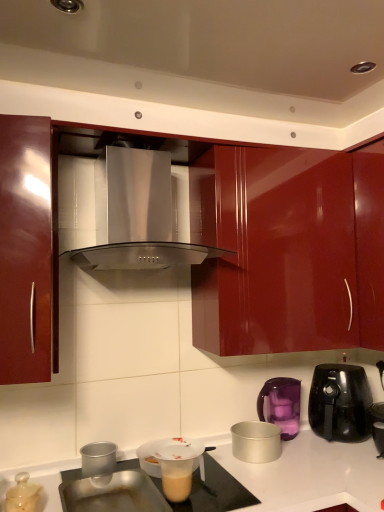
How much space does silver metallic pot at lower center, positioned as the 3th kitchen appliance in left-to-right order, occupy horizontally?

8.74 inches.

Find the location of `black glossy air fryer at right, acting as the 1th kitchen appliance starting from the right`. black glossy air fryer at right, acting as the 1th kitchen appliance starting from the right is located at coordinates (340, 403).

Find the location of a particular element. purple plastic kettle at right, which is the fourth kitchen appliance from left to right is located at coordinates [x=281, y=405].

Find the location of a particular element. The width and height of the screenshot is (384, 512). translucent plastic cup at lower center is located at coordinates (174, 464).

Which is correct: silver metallic pot at lower center, positioned as the 3th kitchen appliance in left-to-right order, is inside translucent plastic lid at lower left, marked as the 5th kitchen appliance in a right-to-left arrangement, or outside of it?

silver metallic pot at lower center, positioned as the 3th kitchen appliance in left-to-right order, is outside translucent plastic lid at lower left, marked as the 5th kitchen appliance in a right-to-left arrangement.

From the image's perspective, is silver metallic pot at lower center, positioned as the 3th kitchen appliance in left-to-right order, beneath translucent plastic lid at lower left, marked as the 1th kitchen appliance in a left-to-right arrangement?

Indeed, from the image's perspective, silver metallic pot at lower center, positioned as the 3th kitchen appliance in left-to-right order, is shown beneath translucent plastic lid at lower left, marked as the 1th kitchen appliance in a left-to-right arrangement.

How much distance is there between silver metallic pot at lower center, positioned as the 3th kitchen appliance in left-to-right order, and translucent plastic lid at lower left, marked as the 1th kitchen appliance in a left-to-right arrangement?

32.76 inches.

Can we say silver metallic pot at lower center, the 3th kitchen appliance from the right, lies outside black glossy air fryer at right, acting as the 1th kitchen appliance starting from the right?

Yes, silver metallic pot at lower center, the 3th kitchen appliance from the right, is located beyond the bounds of black glossy air fryer at right, acting as the 1th kitchen appliance starting from the right.

Locate an element on the screen. the 2nd kitchen appliance to the left of the black glossy air fryer at right, the 5th kitchen appliance positioned from the left, counting from the anchor's position is located at coordinates (256, 441).

Can you confirm if silver metallic pot at lower center, positioned as the 3th kitchen appliance in left-to-right order, is positioned to the right of black glossy air fryer at right, acting as the 1th kitchen appliance starting from the right?

No, silver metallic pot at lower center, positioned as the 3th kitchen appliance in left-to-right order, is not to the right of black glossy air fryer at right, acting as the 1th kitchen appliance starting from the right.

Between silver metallic pot at lower center, the 3th kitchen appliance from the right, and black glossy air fryer at right, the 5th kitchen appliance positioned from the left, which one has more height?

black glossy air fryer at right, the 5th kitchen appliance positioned from the left.

Consider the image. Considering the positions of objects stainless steel range hood at center and purple plastic kettle at right, positioned as the second kitchen appliance in right-to-left order, in the image provided, who is behind, stainless steel range hood at center or purple plastic kettle at right, positioned as the second kitchen appliance in right-to-left order,?

purple plastic kettle at right, positioned as the second kitchen appliance in right-to-left order, is more distant.

Is point (188, 197) closer or farther from the camera than point (258, 408)?

Point (188, 197) appears to be closer to the viewer than point (258, 408).

Would you say purple plastic kettle at right, positioned as the second kitchen appliance in right-to-left order, is part of stainless steel range hood at center's contents?

No, purple plastic kettle at right, positioned as the second kitchen appliance in right-to-left order, is located outside of stainless steel range hood at center.

From a real-world perspective, is stainless steel range hood at center above or below purple plastic kettle at right, which is the fourth kitchen appliance from left to right?

From a real-world perspective, stainless steel range hood at center is physically above purple plastic kettle at right, which is the fourth kitchen appliance from left to right.

Which of these two, glossy red cabinet at left or translucent plastic lid at lower left, marked as the 5th kitchen appliance in a right-to-left arrangement, is wider?

Wider between the two is glossy red cabinet at left.

Considering the relative sizes of glossy red cabinet at left and translucent plastic lid at lower left, marked as the 1th kitchen appliance in a left-to-right arrangement, in the image provided, is glossy red cabinet at left taller than translucent plastic lid at lower left, marked as the 1th kitchen appliance in a left-to-right arrangement,?

Indeed, glossy red cabinet at left has a greater height compared to translucent plastic lid at lower left, marked as the 1th kitchen appliance in a left-to-right arrangement.

From the image's perspective, would you say glossy red cabinet at left is positioned over translucent plastic lid at lower left, marked as the 5th kitchen appliance in a right-to-left arrangement?

Correct, glossy red cabinet at left appears higher than translucent plastic lid at lower left, marked as the 5th kitchen appliance in a right-to-left arrangement, in the image.

Is stainless steel range hood at center oriented away from translucent plastic cup at lower center?

No, stainless steel range hood at center is not facing away from translucent plastic cup at lower center.

From the image's perspective, which is above, stainless steel range hood at center or translucent plastic cup at lower center?

stainless steel range hood at center appears higher in the image.

I want to click on appliance on the right of stainless steel range hood at center, so click(x=174, y=464).

Is stainless steel range hood at center wider or thinner than translucent plastic cup at lower center?

stainless steel range hood at center is wider than translucent plastic cup at lower center.

Considering the relative sizes of glossy red cabinet at left and purple plastic kettle at right, which is the fourth kitchen appliance from left to right, in the image provided, is glossy red cabinet at left shorter than purple plastic kettle at right, which is the fourth kitchen appliance from left to right,?

No.

Considering the positions of objects glossy red cabinet at left and purple plastic kettle at right, which is the fourth kitchen appliance from left to right, in the image provided, who is in front, glossy red cabinet at left or purple plastic kettle at right, which is the fourth kitchen appliance from left to right,?

glossy red cabinet at left is in front.

Which is in front, point (239, 291) or point (269, 402)?

Point (239, 291)

Would you say glossy red cabinet at left contains purple plastic kettle at right, positioned as the second kitchen appliance in right-to-left order?

Actually, purple plastic kettle at right, positioned as the second kitchen appliance in right-to-left order, is outside glossy red cabinet at left.

Is silver metallic pot at lower center, the 3th kitchen appliance from the right, positioned far away from glossy red cabinet at left?

They are positioned close to each other.

Is silver metallic pot at lower center, the 3th kitchen appliance from the right, taller than glossy red cabinet at left?

No.

Between silver metallic pot at lower center, positioned as the 3th kitchen appliance in left-to-right order, and glossy red cabinet at left, which one has smaller size?

With smaller size is silver metallic pot at lower center, positioned as the 3th kitchen appliance in left-to-right order.

Which is in front, point (268, 432) or point (30, 228)?

The point (30, 228) is in front.

Where is `kitchen appliance that is the 1st object above the silver metallic pot at lower center, the 3th kitchen appliance from the right (from a real-world perspective)`? The image size is (384, 512). kitchen appliance that is the 1st object above the silver metallic pot at lower center, the 3th kitchen appliance from the right (from a real-world perspective) is located at coordinates (22, 495).

At what (x,y) coordinates should I click in order to perform the action: click on the 1st kitchen appliance in front of the black glossy air fryer at right, the 5th kitchen appliance positioned from the left. Please return your answer as a coordinate pair (x, y). Looking at the image, I should click on (256, 441).

Looking at the image, which one is located closer to metallic silver cup at lower left, the fourth kitchen appliance positioned from the right, translucent plastic lid at lower left, marked as the 1th kitchen appliance in a left-to-right arrangement, or silver metallic pot at lower center, positioned as the 3th kitchen appliance in left-to-right order?

translucent plastic lid at lower left, marked as the 1th kitchen appliance in a left-to-right arrangement, lies closer to metallic silver cup at lower left, the fourth kitchen appliance positioned from the right, than the other object.

Which object lies further to the anchor point black glossy air fryer at right, the 5th kitchen appliance positioned from the left, translucent plastic lid at lower left, marked as the 5th kitchen appliance in a right-to-left arrangement, or glossy red cabinet at left?

Among the two, translucent plastic lid at lower left, marked as the 5th kitchen appliance in a right-to-left arrangement, is located further to black glossy air fryer at right, the 5th kitchen appliance positioned from the left.

When comparing their distances from translucent plastic cup at lower center, does metallic silver cup at lower left, placed as the 2th kitchen appliance when sorted from left to right, or black glossy air fryer at right, acting as the 1th kitchen appliance starting from the right, seem further?

black glossy air fryer at right, acting as the 1th kitchen appliance starting from the right, is further to translucent plastic cup at lower center.

From the image, which object appears to be farther from translucent plastic lid at lower left, marked as the 5th kitchen appliance in a right-to-left arrangement, silver metallic pot at lower center, the 3th kitchen appliance from the right, or glossy red cabinet at left?

The object further to translucent plastic lid at lower left, marked as the 5th kitchen appliance in a right-to-left arrangement, is glossy red cabinet at left.

Consider the image. Based on their spatial positions, is metallic silver cup at lower left, the fourth kitchen appliance positioned from the right, or translucent plastic cup at lower center further from translucent plastic lid at lower left, marked as the 1th kitchen appliance in a left-to-right arrangement?

Based on the image, translucent plastic cup at lower center appears to be further to translucent plastic lid at lower left, marked as the 1th kitchen appliance in a left-to-right arrangement.

Which object lies further to the anchor point translucent plastic cup at lower center, black glossy air fryer at right, the 5th kitchen appliance positioned from the left, or silver metallic pot at lower center, the 3th kitchen appliance from the right?

black glossy air fryer at right, the 5th kitchen appliance positioned from the left.

Considering their positions, is metallic silver cup at lower left, placed as the 2th kitchen appliance when sorted from left to right, positioned further to silver metallic pot at lower center, positioned as the 3th kitchen appliance in left-to-right order, than translucent plastic lid at lower left, marked as the 1th kitchen appliance in a left-to-right arrangement?

translucent plastic lid at lower left, marked as the 1th kitchen appliance in a left-to-right arrangement, is further to silver metallic pot at lower center, positioned as the 3th kitchen appliance in left-to-right order.

Estimate the real-world distances between objects in this image. Which object is further from metallic silver cup at lower left, placed as the 2th kitchen appliance when sorted from left to right, black glossy air fryer at right, acting as the 1th kitchen appliance starting from the right, or stainless steel range hood at center?

Based on the image, black glossy air fryer at right, acting as the 1th kitchen appliance starting from the right, appears to be further to metallic silver cup at lower left, placed as the 2th kitchen appliance when sorted from left to right.

Identify the location of appliance between stainless steel range hood at center and silver metallic pot at lower center, positioned as the 3th kitchen appliance in left-to-right order, vertically. (174, 464).

You are a GUI agent. You are given a task and a screenshot of the screen. Output one action in this format:
    pyautogui.click(x=<x>, y=<y>)
    Task: Click on the kitchen appliance between translucent plastic lid at lower left, marked as the 5th kitchen appliance in a right-to-left arrangement, and translucent plastic cup at lower center
    The width and height of the screenshot is (384, 512).
    Given the screenshot: What is the action you would take?
    pyautogui.click(x=98, y=459)

Locate an element on the screen. This screenshot has width=384, height=512. appliance between translucent plastic lid at lower left, marked as the 1th kitchen appliance in a left-to-right arrangement, and black glossy air fryer at right, the 5th kitchen appliance positioned from the left, in the horizontal direction is located at coordinates (174, 464).

Where is `appliance located between glossy red cabinet at left and silver metallic pot at lower center, positioned as the 3th kitchen appliance in left-to-right order, in the depth direction`? appliance located between glossy red cabinet at left and silver metallic pot at lower center, positioned as the 3th kitchen appliance in left-to-right order, in the depth direction is located at coordinates (174, 464).